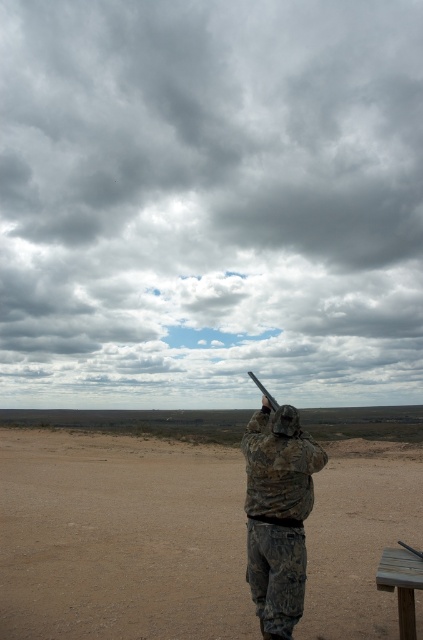
Question: Is dull brown dirt at center below camouflage fabric soldier at center?

Choices:
 (A) yes
 (B) no

Answer: (A)

Question: Which point is closer to the camera?

Choices:
 (A) (269, 401)
 (B) (297, 483)
 (C) (49, 545)

Answer: (B)

Question: Which point is closer to the camera?

Choices:
 (A) camouflage fabric soldier at center
 (B) matte black shotgun at upper center

Answer: (A)

Question: Which object is the farthest from the dull brown dirt at center?

Choices:
 (A) matte black shotgun at upper center
 (B) camouflage fabric soldier at center

Answer: (B)

Question: Can you confirm if camouflage fabric soldier at center is positioned below matte black shotgun at upper center?

Choices:
 (A) yes
 (B) no

Answer: (B)

Question: From the image, what is the correct spatial relationship of dull brown dirt at center in relation to matte black shotgun at upper center?

Choices:
 (A) left
 (B) right

Answer: (A)